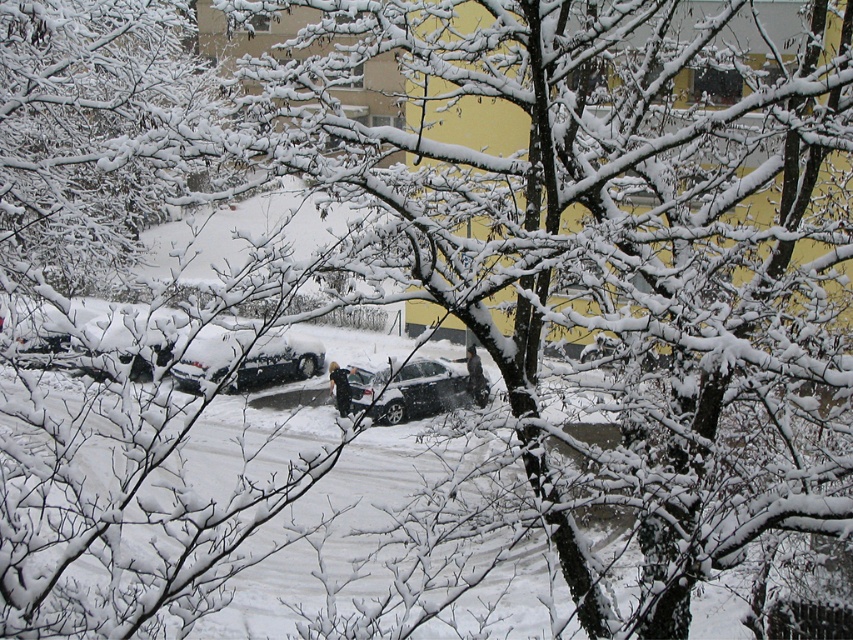
You are a delivery person with a cart that is 3 meters wide. You need to move between the sleek black car at center and the satin silver sedan at center. Can your cart fit through the space between them?

The distance between the sleek black car at center and the satin silver sedan at center is 2.98 meters. Since your cart is 3 meters wide, it is slightly wider than the available space. Therefore, your cart cannot fit through the space between them.